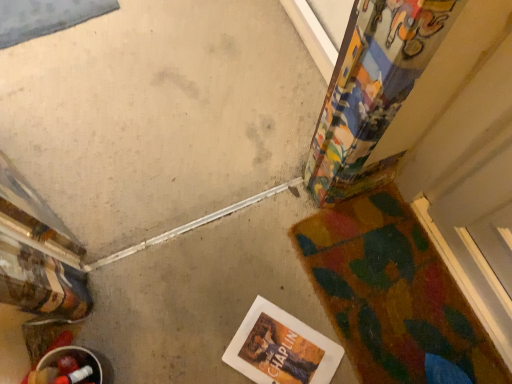
The height and width of the screenshot is (384, 512). What are the coordinates of `vacant space behind hardcover book at lower center` in the screenshot? It's located at (263, 283).